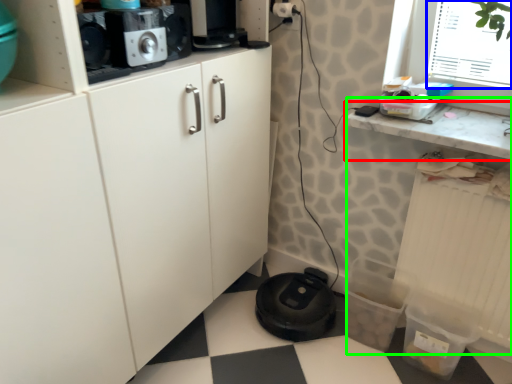
Question: Which object is the farthest from countertop (highlighted by a red box)? Choose among these: window screen (highlighted by a blue box) or counter (highlighted by a green box).

Choices:
 (A) window screen
 (B) counter

Answer: (A)